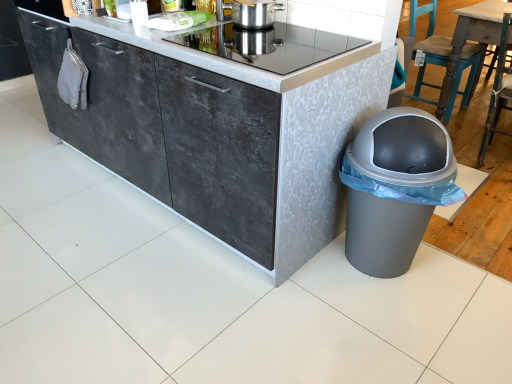
Image resolution: width=512 pixels, height=384 pixels. What are the coordinates of `free space that is to the left of gray plastic trash can at lower right` in the screenshot? It's located at (309, 287).